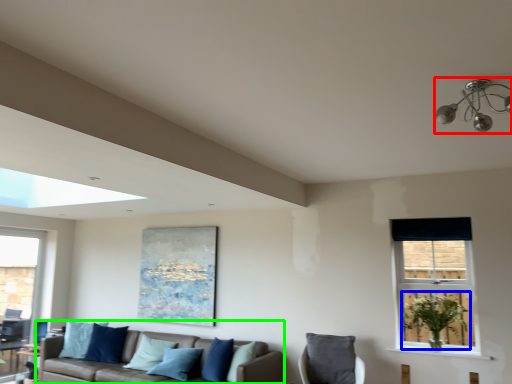
Question: Estimate the real-world distances between objects in this image. Which object is farther from light fixture (highlighted by a red box), plant (highlighted by a blue box) or studio couch (highlighted by a green box)?

Choices:
 (A) plant
 (B) studio couch

Answer: (B)